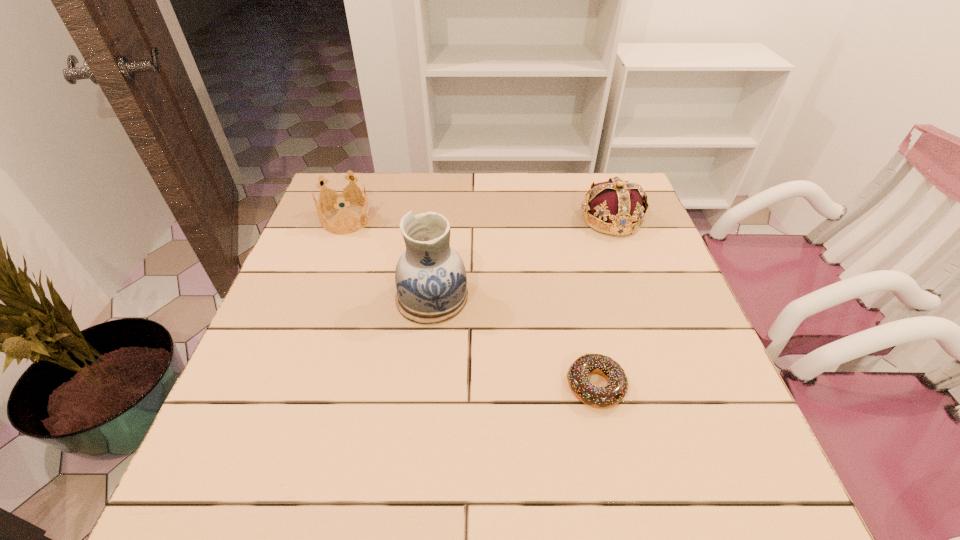
Locate which object ranks second in proximity to the tallest object. Please provide its 2D coordinates. Your answer should be formatted as a tuple, i.e. [(x, y)], where the tuple contains the x and y coordinates of a point satisfying the conditions above.

[(616, 389)]

The height and width of the screenshot is (540, 960). Identify the location of the closest object to the tallest object. click(340, 197).

Where is `free spot that satisfies the following two spatial constraints: 1. on the front side of the doughnut; 2. on the right side of the second shortest object`? This screenshot has height=540, width=960. free spot that satisfies the following two spatial constraints: 1. on the front side of the doughnut; 2. on the right side of the second shortest object is located at coordinates (286, 386).

Where is `vacant area in the image that satisfies the following two spatial constraints: 1. on the front side of the left crown; 2. on the right side of the right crown`? vacant area in the image that satisfies the following two spatial constraints: 1. on the front side of the left crown; 2. on the right side of the right crown is located at coordinates (347, 220).

This screenshot has width=960, height=540. What are the coordinates of `free space that satisfies the following two spatial constraints: 1. on the front side of the doughnut; 2. on the left side of the second nearest object` in the screenshot? It's located at (422, 386).